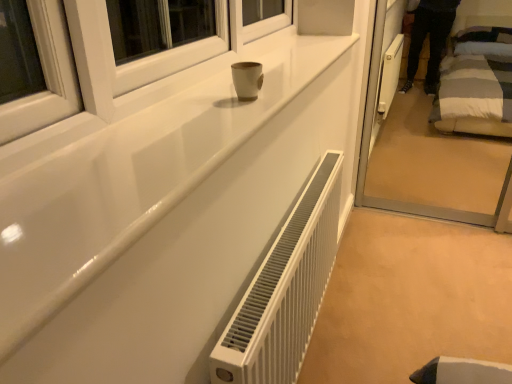
Describe the element at coordinates (285, 290) in the screenshot. The image size is (512, 384). I see `white metallic radiator at lower center` at that location.

Image resolution: width=512 pixels, height=384 pixels. What are the coordinates of `white metallic radiator at lower center` in the screenshot? It's located at [285, 290].

The image size is (512, 384). What are the coordinates of `white metallic radiator at lower center` in the screenshot? It's located at (285, 290).